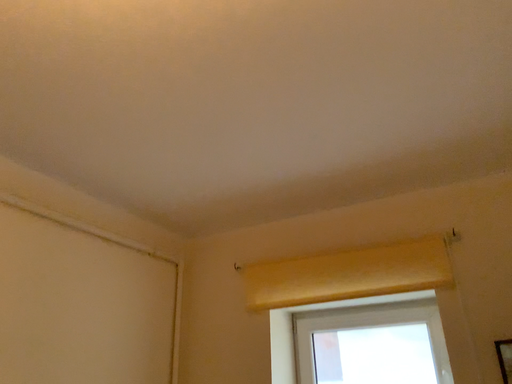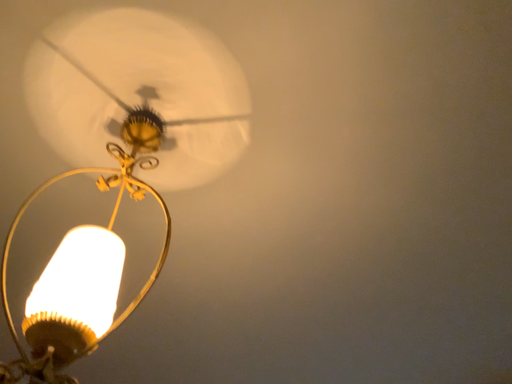
Question: How did the camera likely rotate when shooting the video?

Choices:
 (A) rotated upward
 (B) rotated downward

Answer: (A)